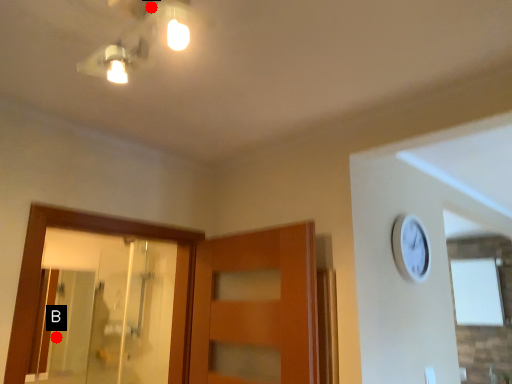
Question: Two points are circled on the image, labeled by A and B beside each circle. Which of the following is the farthest from the observer?

Choices:
 (A) A is further
 (B) B is further

Answer: (B)